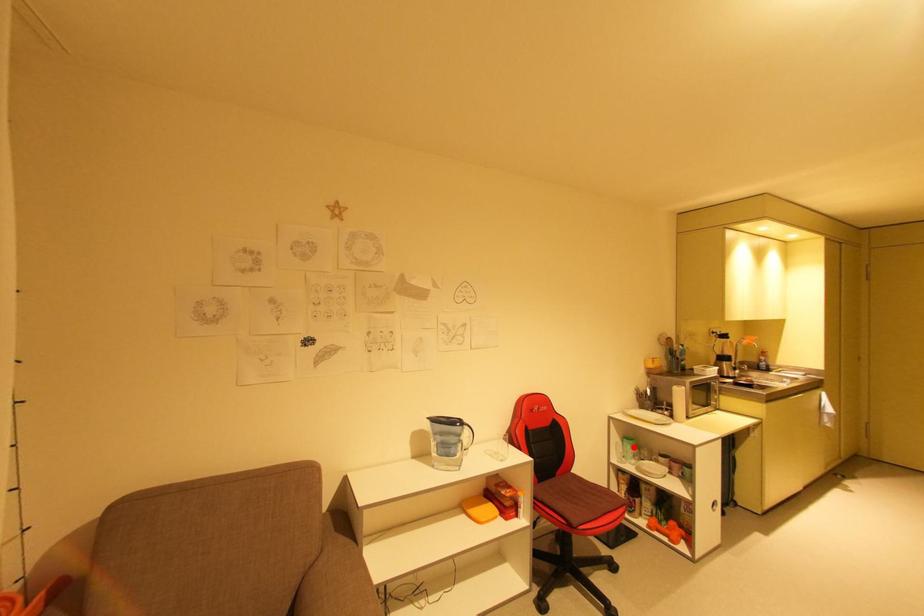
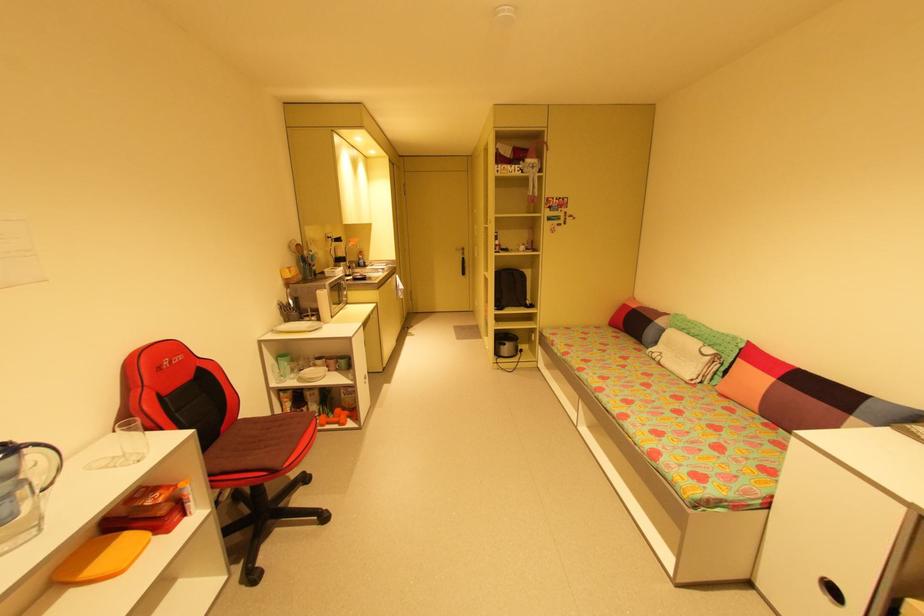
Question: I am providing you with two images of the same scene from different viewpoints. Given a red point in image1, look at the same physical point in image2. Is it:

Choices:
 (A) Closer to the viewpoint
 (B) Farther from the viewpoint

Answer: (A)